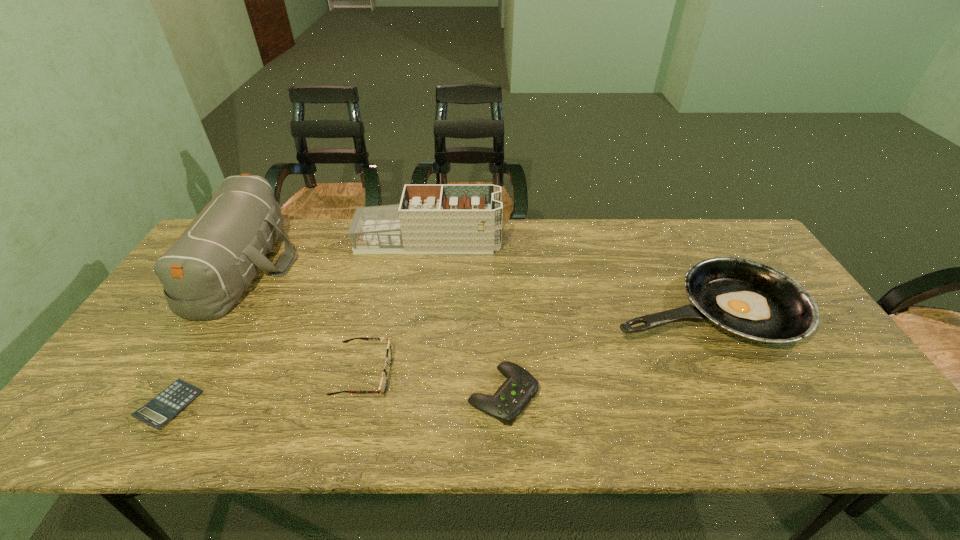
In order to click on free space that satisfies the following two spatial constraints: 1. at the entrance of the frying pan; 2. on the left side of the second tallest object in this screenshot , I will do `click(420, 309)`.

The height and width of the screenshot is (540, 960). I want to click on free region that satisfies the following two spatial constraints: 1. on the frame of the fourth tallest object; 2. on the back side of the control, so click(359, 395).